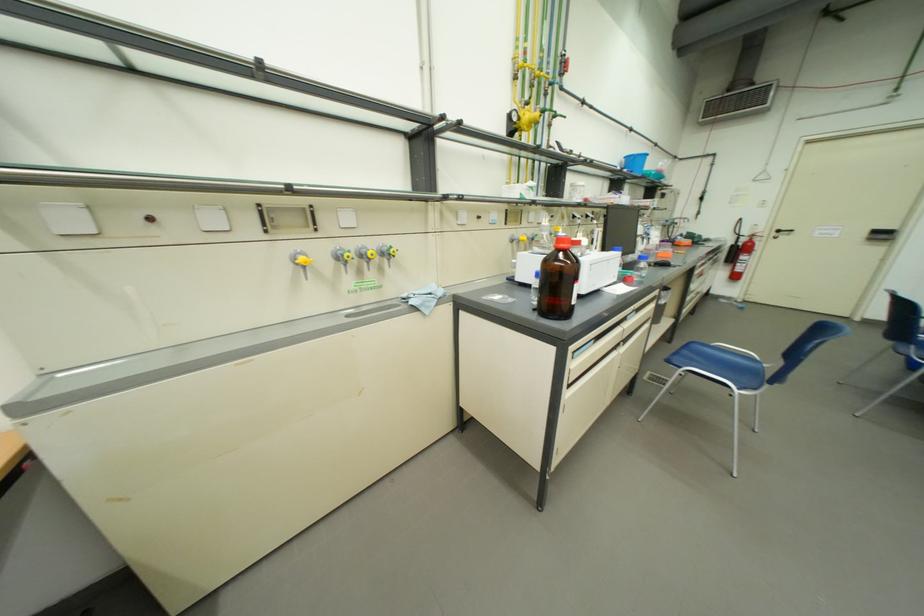
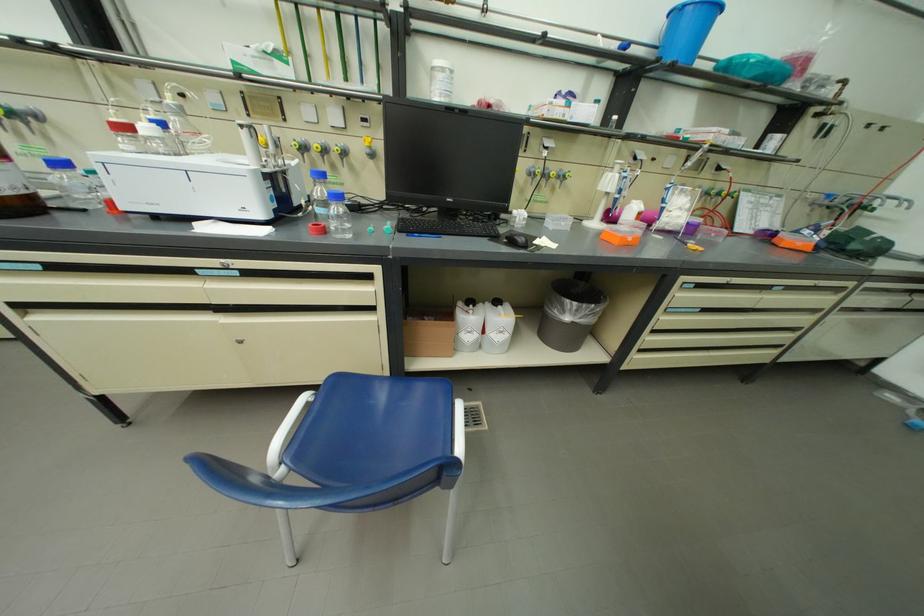
Where in the second image is the point corresponding to pixel 689 244 from the first image?

(793, 241)